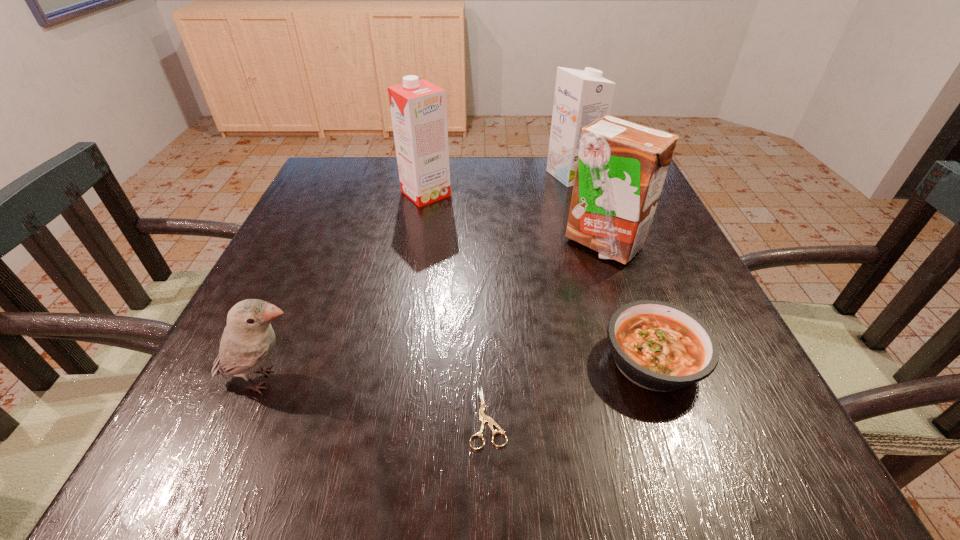
The image size is (960, 540). In order to click on the second closest object relative to the leftmost object in this screenshot , I will do `click(659, 346)`.

Identify which object is the fifth nearest to the nearest carton. Please provide its 2D coordinates. Your answer should be formatted as a tuple, i.e. [(x, y)], where the tuple contains the x and y coordinates of a point satisfying the conditions above.

[(248, 340)]

Select which carton appears as the second closest to the stew. Please provide its 2D coordinates. Your answer should be formatted as a tuple, i.e. [(x, y)], where the tuple contains the x and y coordinates of a point satisfying the conditions above.

[(418, 108)]

Identify the location of carton that is the second nearest to the third farthest object. (418, 108).

Where is `vacant space that satisfies the following two spatial constraints: 1. on the straw side of the nearest carton; 2. on the right side of the stew`? The height and width of the screenshot is (540, 960). vacant space that satisfies the following two spatial constraints: 1. on the straw side of the nearest carton; 2. on the right side of the stew is located at coordinates (642, 361).

This screenshot has width=960, height=540. In order to click on blank space that satisfies the following two spatial constraints: 1. at the face of the shears; 2. on the left side of the fourth tallest object in this screenshot , I will do `click(249, 417)`.

You are a GUI agent. You are given a task and a screenshot of the screen. Output one action in this format:
    pyautogui.click(x=<x>, y=<y>)
    Task: Click on the vacant space that satisfies the following two spatial constraints: 1. on the straw side of the nearest carton; 2. on the right side of the stew
    This screenshot has height=540, width=960.
    Given the screenshot: What is the action you would take?
    pyautogui.click(x=642, y=361)

You are a GUI agent. You are given a task and a screenshot of the screen. Output one action in this format:
    pyautogui.click(x=<x>, y=<y>)
    Task: Click on the vacant space that satisfies the following two spatial constraints: 1. on the straw side of the fifth tallest object; 2. on the right side of the fourth nearest object
    This screenshot has width=960, height=540.
    Given the screenshot: What is the action you would take?
    pyautogui.click(x=642, y=361)